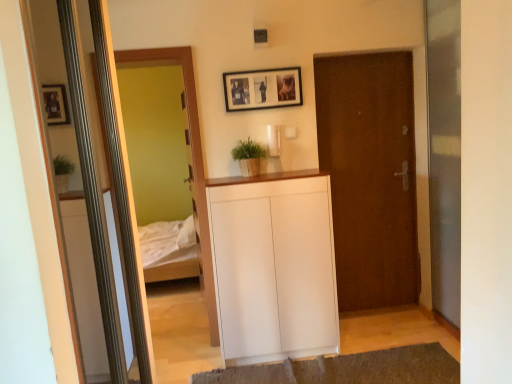
Locate an element on the screen. vacant area that lies in front of brown matte door at center is located at coordinates (382, 329).